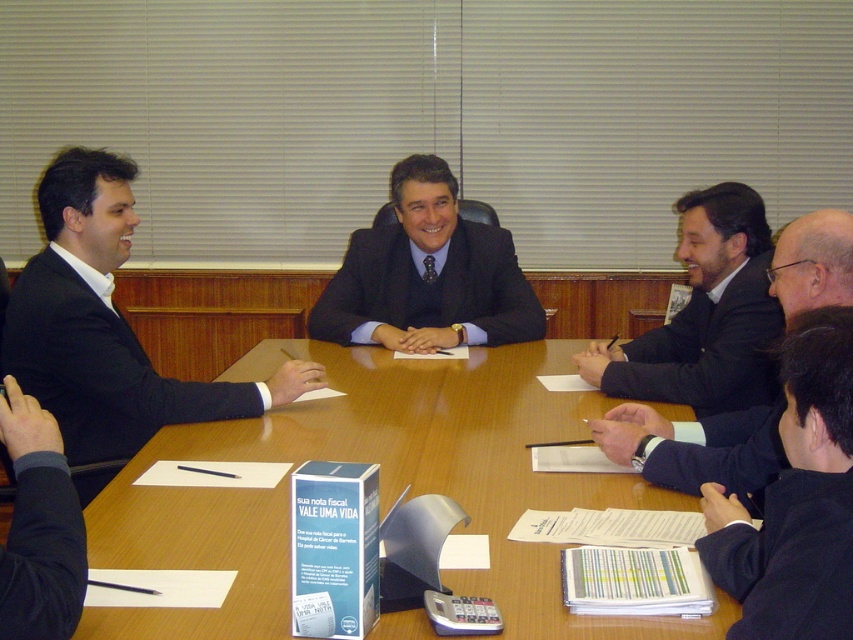
Does matte black suit at center appear over black matte suit at lower right?

Correct, matte black suit at center is located above black matte suit at lower right.

Between point (502, 240) and point (686, 378), which one is positioned behind?

Point (502, 240)

Between point (358, 252) and point (711, 356), which one is positioned in front?

Point (711, 356) is more forward.

Where is `matte black suit at center`? This screenshot has width=853, height=640. matte black suit at center is located at coordinates (428, 289).

Which is above, wooden table at center or matte black suit at center?

matte black suit at center is higher up.

Who is positioned more to the right, wooden table at center or matte black suit at center?

Positioned to the right is wooden table at center.

Which is in front, point (265, 340) or point (537, 324)?

Positioned in front is point (537, 324).

Locate an element on the screen. The image size is (853, 640). wooden table at center is located at coordinates pos(379,490).

Is matte black suit at left taller than black matte suit at lower right?

Yes, matte black suit at left is taller than black matte suit at lower right.

Looking at this image, does matte black suit at left lie behind black matte suit at lower right?

No, it is not.

At what (x,y) coordinates should I click in order to perform the action: click on matte black suit at left. Please return your answer as a coordinate pair (x, y). Looking at the image, I should click on (99, 368).